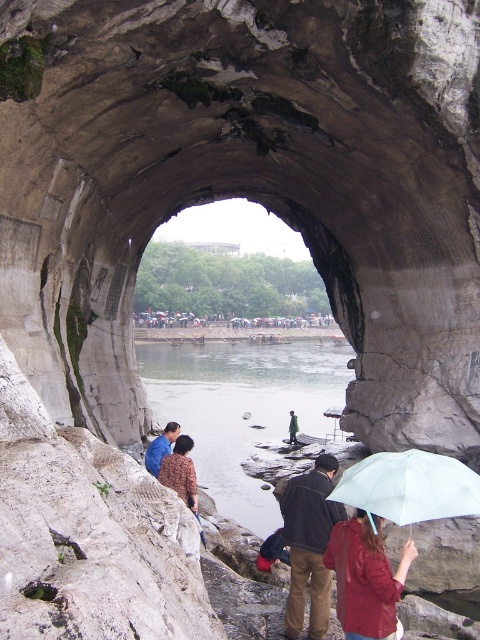
Based on the photo, you are a hiker who has reached the rock archway and wants to cross the clear water at center to join the group on the other side. The green fabric jacket at center is hanging from the rock archway above. Can you safely cross the water without getting your feet wet?

The clear water at center is positioned under the green fabric jacket at center, which means the jacket is above the water. Since the jacket is hanging above, it does not block the water path. Therefore, you can safely cross the clear water at center to reach the group, but your feet will get wet as the water is present there.

Consider the image. You are standing at the entrance of the rock archway and see two jackets, a dark brown leather jacket at center and a red leather jacket at lower right. Which jacket is closer to you?

The dark brown leather jacket at center is closer to you because the red leather jacket at lower right is behind it.